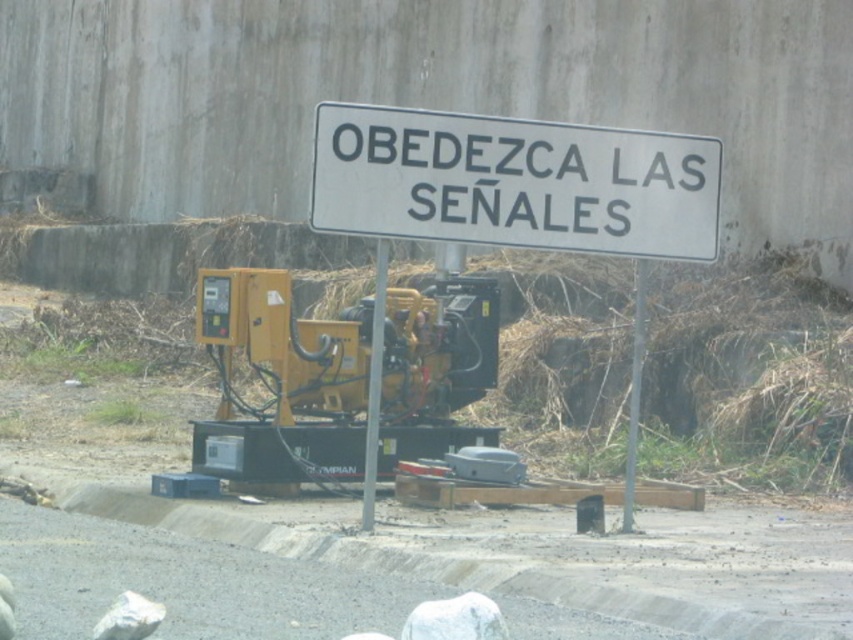
Question: Among these points, which one is farthest from the camera?

Choices:
 (A) (624, 464)
 (B) (384, 262)

Answer: (A)

Question: Which of the following is the closest to the observer?

Choices:
 (A) metallic pole at center
 (B) yellow metallic generator at center
 (C) white plastic sign at upper center

Answer: (C)

Question: Which point is closer to the camera?

Choices:
 (A) metallic pole at center
 (B) white plastic sign at upper center
 (C) yellow metallic generator at center

Answer: (B)

Question: In this image, where is white plastic sign at upper center located relative to metallic pole at center?

Choices:
 (A) below
 (B) above

Answer: (B)

Question: From the image, what is the correct spatial relationship of yellow metallic generator at center in relation to metallic pole at center?

Choices:
 (A) right
 (B) left

Answer: (B)

Question: Does white plastic sign at upper center appear on the right side of metallic pole at center?

Choices:
 (A) no
 (B) yes

Answer: (A)